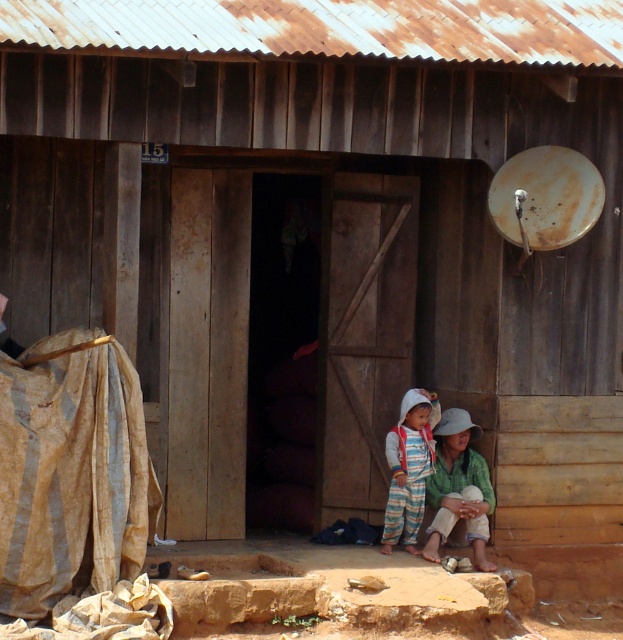
Can you confirm if light brown fabric at lower center is smaller than light gray cotton pants at center?

No, light brown fabric at lower center is not smaller than light gray cotton pants at center.

Can you confirm if light brown fabric at lower center is positioned above light gray cotton pants at center?

No.

Does point (465, 410) lie behind point (416, 464)?

Yes.

Find the location of a particular element. This screenshot has width=623, height=640. light brown fabric at lower center is located at coordinates tap(459, 486).